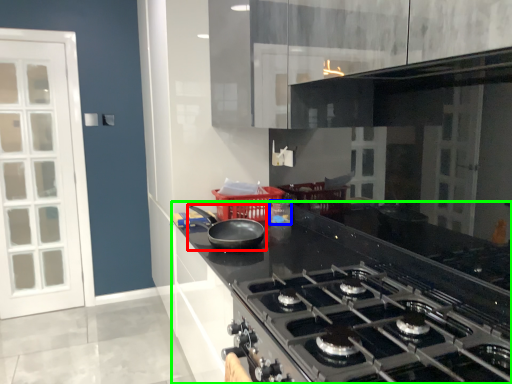
Question: Which is farther away from kitchen appliance (highlighted by a red box)? appliance (highlighted by a blue box) or countertop (highlighted by a green box)?

Choices:
 (A) appliance
 (B) countertop

Answer: (B)